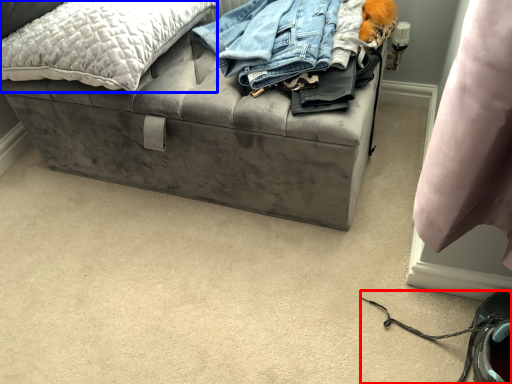
Question: Which object appears closest to the camera in this image, shoe (highlighted by a red box) or pillow (highlighted by a blue box)?

Choices:
 (A) shoe
 (B) pillow

Answer: (A)